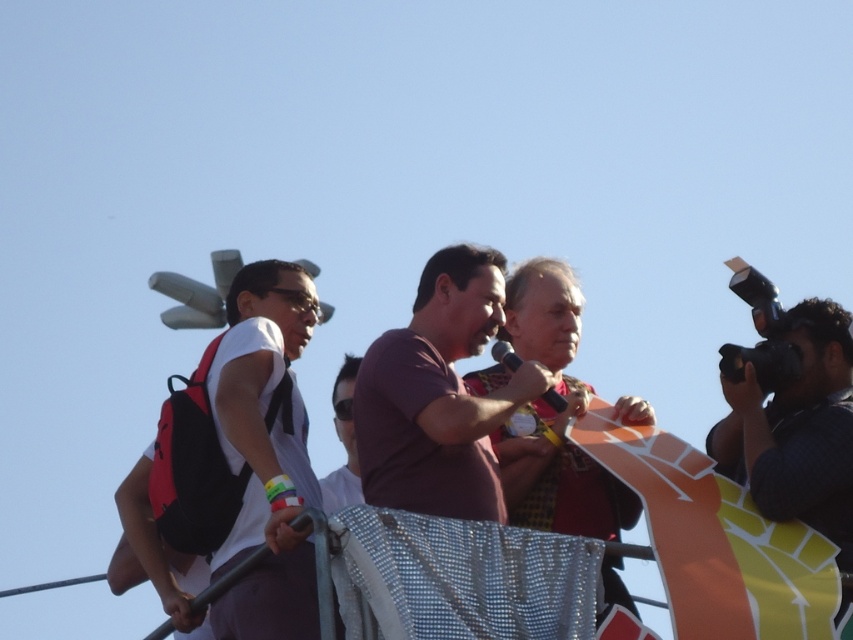
Does white matte shirt at left appear on the left side of purple matte shirt at center?

Correct, you'll find white matte shirt at left to the left of purple matte shirt at center.

Is point (251, 529) more distant than point (453, 416)?

Yes, point (251, 529) is behind point (453, 416).

This screenshot has width=853, height=640. What do you see at coordinates (262, 451) in the screenshot?
I see `white matte shirt at left` at bounding box center [262, 451].

At what (x,y) coordinates should I click in order to perform the action: click on white matte shirt at left. Please return your answer as a coordinate pair (x, y). Image resolution: width=853 pixels, height=640 pixels. Looking at the image, I should click on (262, 451).

Does purple matte shirt at center appear under black textured camera at right?

No.

Is point (427, 326) positioned in front of point (822, 369)?

Yes.

Where is `purple matte shirt at center`? This screenshot has width=853, height=640. purple matte shirt at center is located at coordinates (438, 396).

Can you confirm if white matte shirt at left is positioned to the right of black textured camera at right?

Incorrect, white matte shirt at left is not on the right side of black textured camera at right.

Does white matte shirt at left have a greater height compared to black textured camera at right?

Correct, white matte shirt at left is much taller as black textured camera at right.

The width and height of the screenshot is (853, 640). I want to click on white matte shirt at left, so click(x=262, y=451).

Where is `white matte shirt at left`? This screenshot has width=853, height=640. white matte shirt at left is located at coordinates (262, 451).